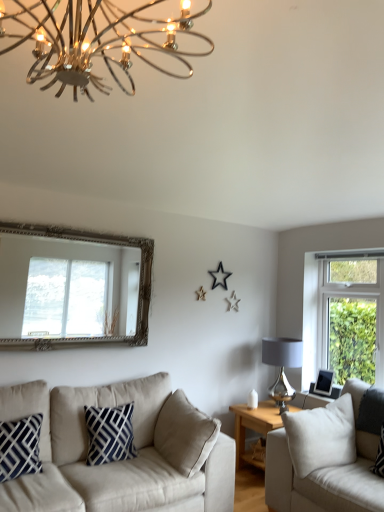
Locate an element on the screen. vacant space underneath silver ornate mirror at upper left (from a real-world perspective) is located at coordinates (59, 372).